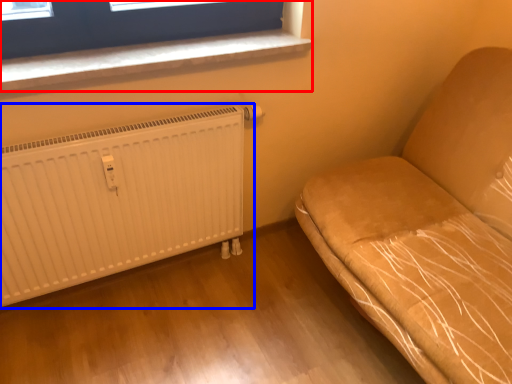
Question: Which of the following is the farthest to the observer, window (highlighted by a red box) or radiator (highlighted by a blue box)?

Choices:
 (A) window
 (B) radiator

Answer: (A)